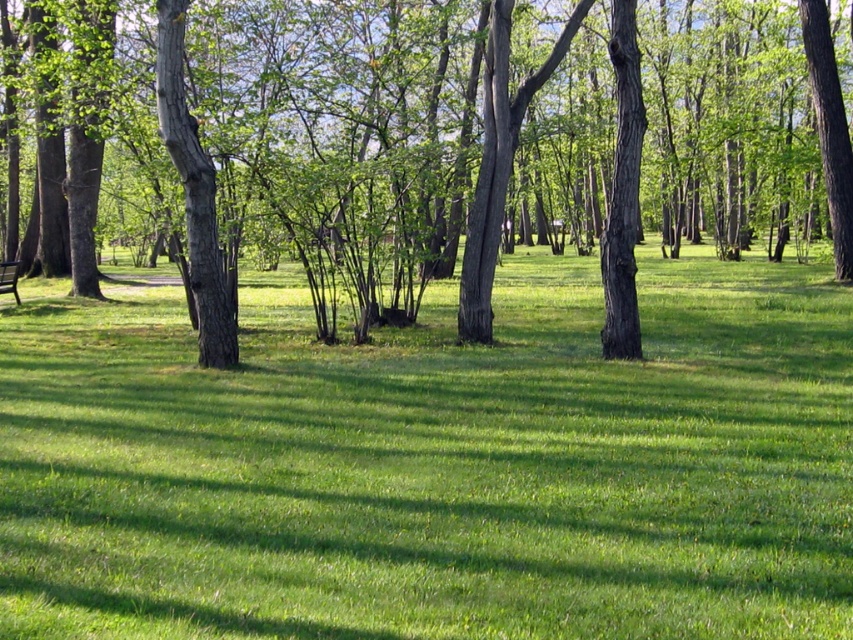
Who is positioned more to the right, green grassy at center or brown rough tree at center?

green grassy at center

This screenshot has height=640, width=853. Describe the element at coordinates (434, 464) in the screenshot. I see `green grassy at center` at that location.

Image resolution: width=853 pixels, height=640 pixels. Find the location of `green grassy at center`. green grassy at center is located at coordinates (434, 464).